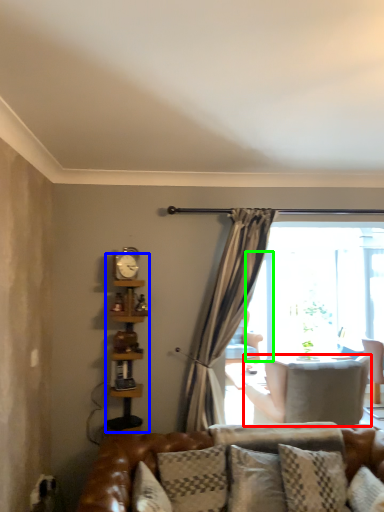
Question: Which object is the closest to the chair (highlighted by a red box)? Choose among these: bookshelf (highlighted by a blue box) or screen door (highlighted by a green box).

Choices:
 (A) bookshelf
 (B) screen door

Answer: (B)